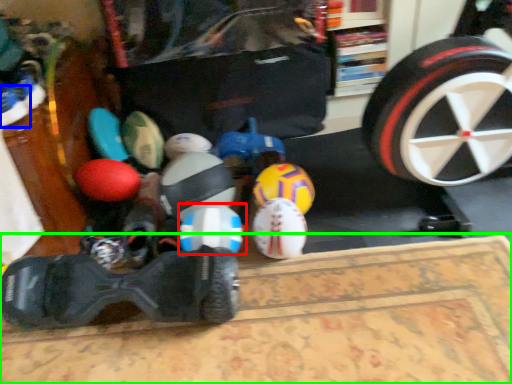
Question: Which is farther away from toy (highlighted by a red box)? footwear (highlighted by a blue box) or mat (highlighted by a green box)?

Choices:
 (A) footwear
 (B) mat

Answer: (A)